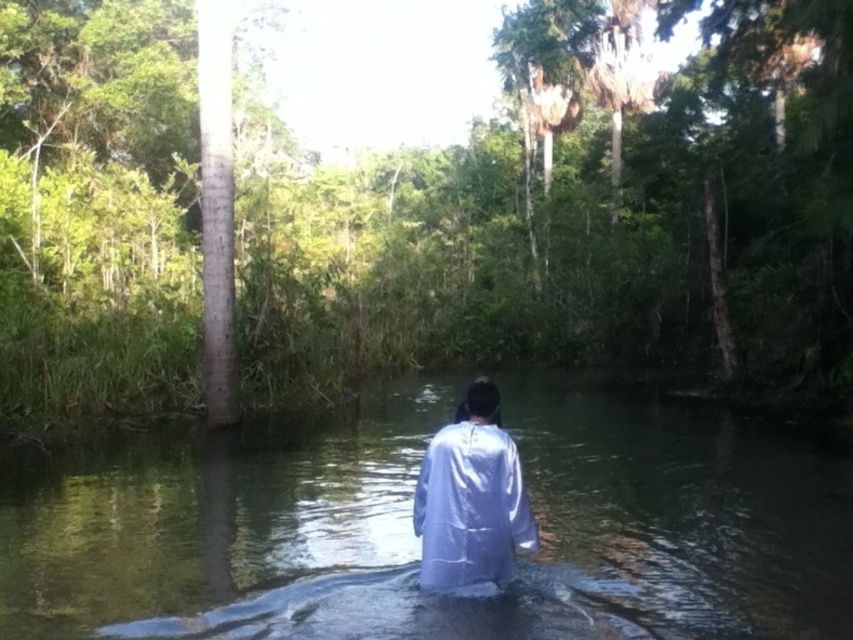
Question: Is clear water at center above silvery reflective robe at center?

Choices:
 (A) yes
 (B) no

Answer: (A)

Question: From the image, what is the correct spatial relationship of clear water at center in relation to silvery reflective robe at center?

Choices:
 (A) above
 (B) below

Answer: (A)

Question: Which point appears closest to the camera in this image?

Choices:
 (A) (664, 579)
 (B) (491, 541)

Answer: (B)

Question: Which object appears closest to the camera in this image?

Choices:
 (A) silvery reflective robe at center
 (B) clear water at center

Answer: (A)

Question: Is clear water at center further to camera compared to silvery reflective robe at center?

Choices:
 (A) yes
 (B) no

Answer: (A)